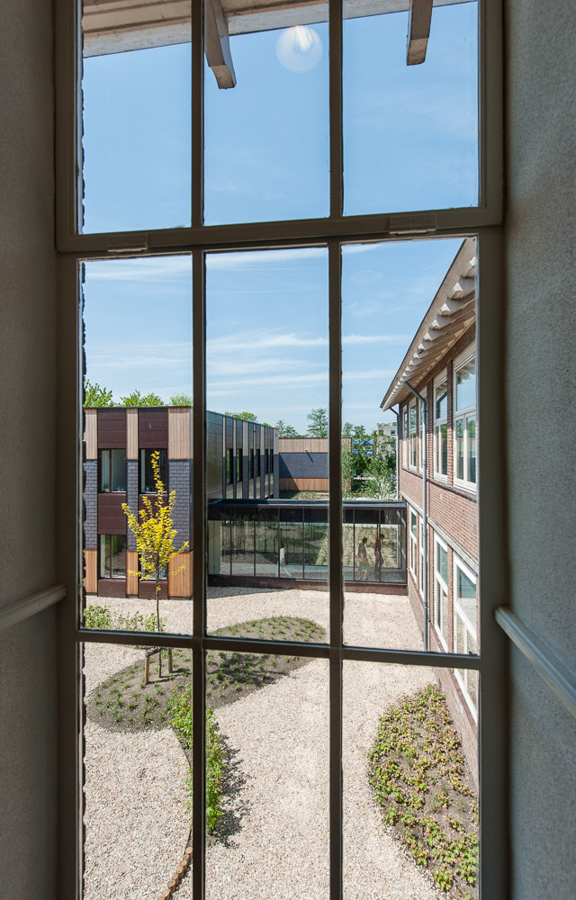
The height and width of the screenshot is (900, 576). In order to click on wooden building accents in this screenshot , I will do `click(181, 579)`, `click(135, 583)`, `click(87, 580)`.